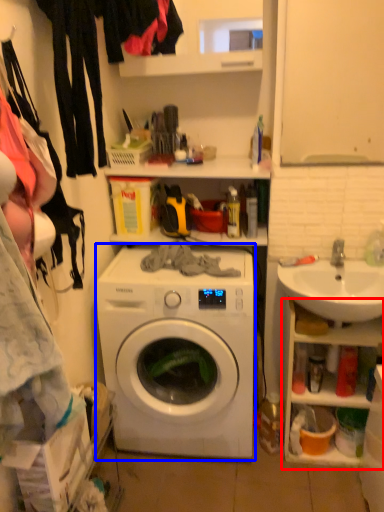
Question: Among these objects, which one is farthest to the camera, cabinet (highlighted by a red box) or washing machine (highlighted by a blue box)?

Choices:
 (A) cabinet
 (B) washing machine

Answer: (A)